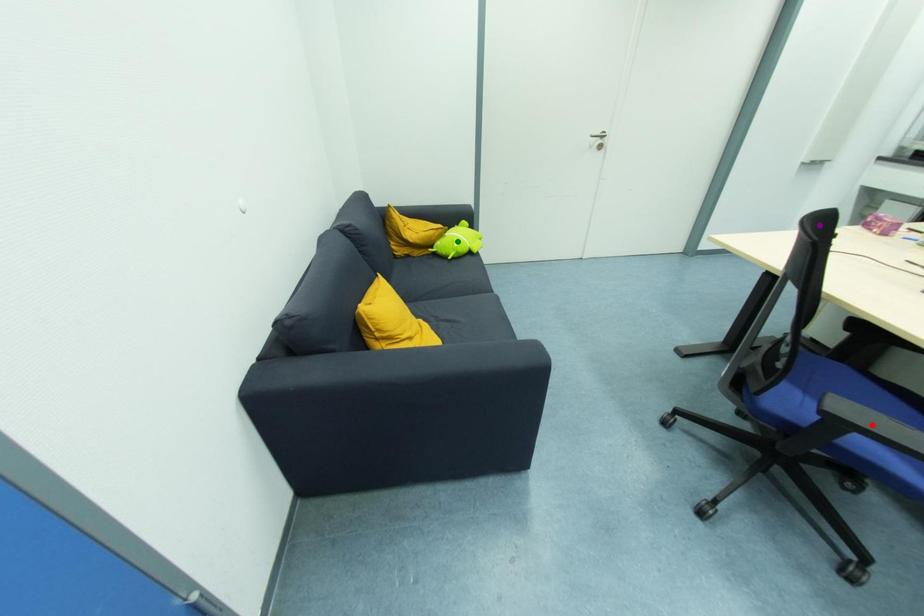
Order these from nearest to farthest:
- green point
- purple point
- red point

red point
green point
purple point